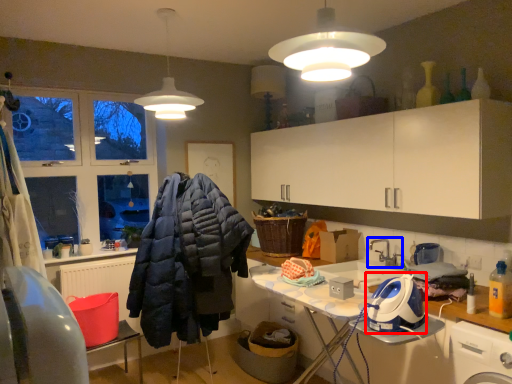
Question: Which object is closer to the camera taking this photo, appliance (highlighted by a red box) or tap (highlighted by a blue box)?

Choices:
 (A) appliance
 (B) tap

Answer: (A)